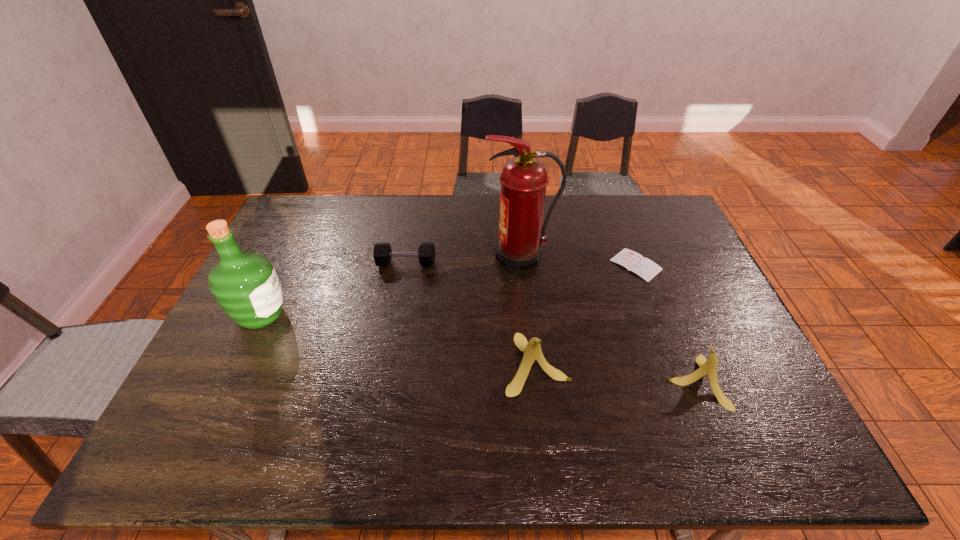
The width and height of the screenshot is (960, 540). What are the coordinates of `diary that is at the right edge` in the screenshot? It's located at (632, 261).

The height and width of the screenshot is (540, 960). I want to click on object present at the near right corner, so click(708, 367).

At what (x,y) coordinates should I click in order to perform the action: click on vacant space at the far edge of the desktop. Please return your answer as a coordinate pair (x, y). The height and width of the screenshot is (540, 960). Looking at the image, I should click on (600, 219).

Where is `vacant space at the near edge of the desktop`? This screenshot has width=960, height=540. vacant space at the near edge of the desktop is located at coordinates (458, 410).

In the image, there is a desktop. Where is `vacant space at the left edge`? This screenshot has width=960, height=540. vacant space at the left edge is located at coordinates (211, 362).

Locate an element on the screen. This screenshot has height=540, width=960. vacant space at the right edge of the desktop is located at coordinates (707, 286).

In the image, there is a desktop. Where is `free space at the far right corner`? free space at the far right corner is located at coordinates (667, 206).

This screenshot has height=540, width=960. Identify the location of blank space at the near right corner. (763, 404).

Identify the location of vacant point located between the shortest object and the fire extinguisher. Image resolution: width=960 pixels, height=540 pixels. (x=578, y=261).

Image resolution: width=960 pixels, height=540 pixels. I want to click on blank region between the diary and the leftmost object, so click(x=449, y=290).